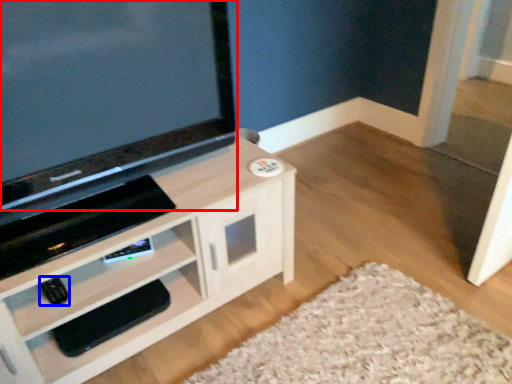
Question: Among these objects, which one is nearest to the camera, television (highlighted by a red box) or remote (highlighted by a blue box)?

Choices:
 (A) television
 (B) remote

Answer: (A)